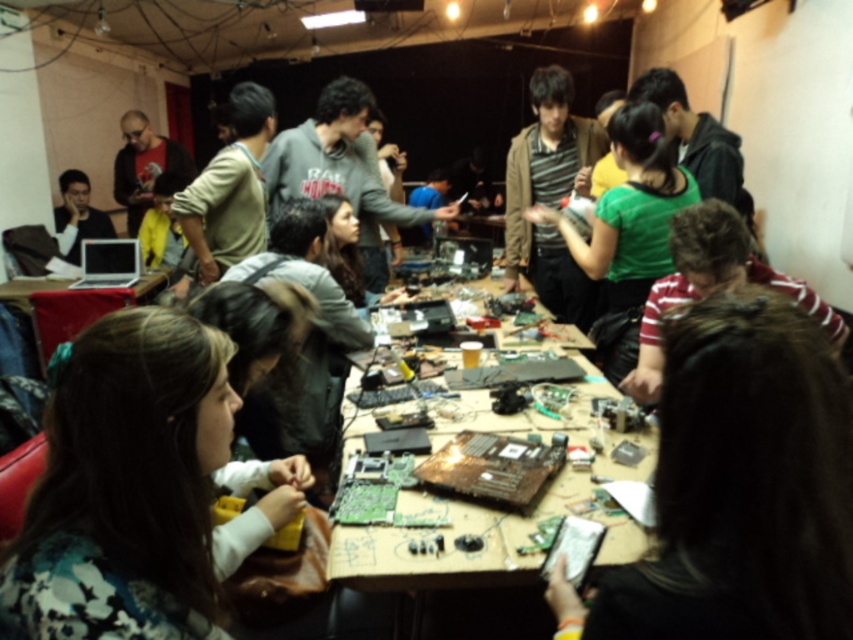
Consider the image. Can you confirm if floral fabric shirt at lower left is positioned above wooden table at center?

Indeed, floral fabric shirt at lower left is positioned over wooden table at center.

Is point (62, 627) in front of point (347, 540)?

Yes, it is in front of point (347, 540).

Where is `floral fabric shirt at lower left`? floral fabric shirt at lower left is located at coordinates (126, 484).

Is floral fabric shirt at lower left to the right of matte wooden table at center from the viewer's perspective?

Correct, you'll find floral fabric shirt at lower left to the right of matte wooden table at center.

Which is below, floral fabric shirt at lower left or matte wooden table at center?

floral fabric shirt at lower left is lower down.

Where is `floral fabric shirt at lower left`? The image size is (853, 640). floral fabric shirt at lower left is located at coordinates (126, 484).

Does black matte hair at upper right have a greater width compared to wooden table at center?

No.

Is point (757, 321) less distant than point (593, 467)?

Yes.

Measure the distance between black matte hair at upper right and camera.

They are 69.78 centimeters apart.

Image resolution: width=853 pixels, height=640 pixels. In order to click on black matte hair at upper right in this screenshot , I will do `click(740, 486)`.